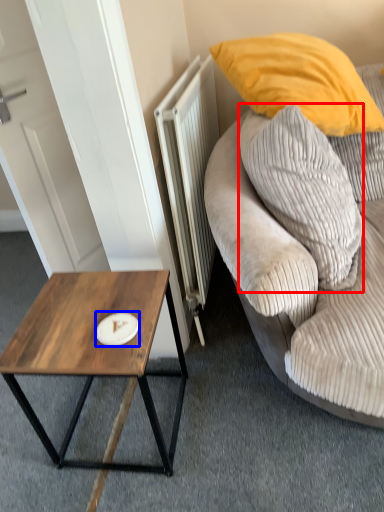
Question: Among these objects, which one is nearest to the camera, pillow (highlighted by a red box) or plate (highlighted by a blue box)?

Choices:
 (A) pillow
 (B) plate

Answer: (A)